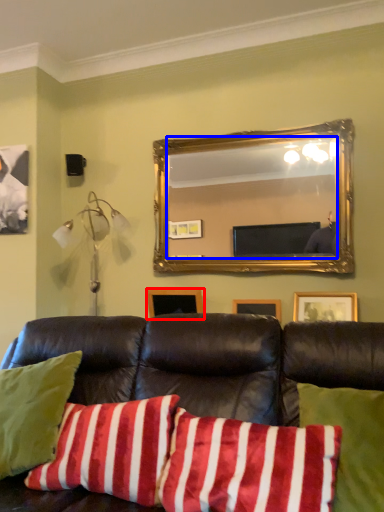
Question: Which of the following is the farthest to the observer, picture frame (highlighted by a red box) or mirror (highlighted by a blue box)?

Choices:
 (A) picture frame
 (B) mirror

Answer: (A)